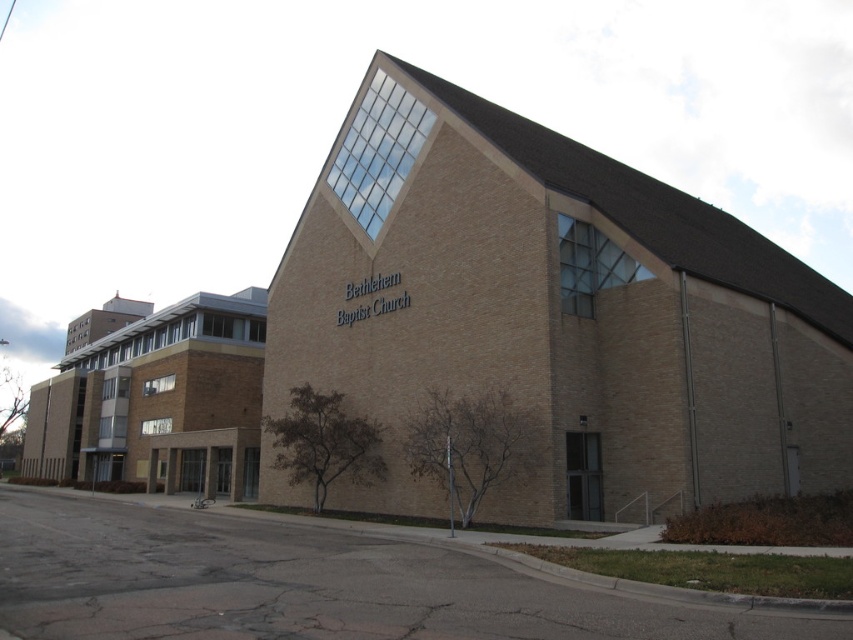
Question: Which object appears farthest from the camera in this image?

Choices:
 (A) brown brick building at left
 (B) brown brick church at center

Answer: (A)

Question: Is brown brick church at center to the left of brown brick building at left from the viewer's perspective?

Choices:
 (A) yes
 (B) no

Answer: (B)

Question: Which point is farther to the camera?

Choices:
 (A) brown brick church at center
 (B) brown brick building at left

Answer: (B)

Question: Which object appears closest to the camera in this image?

Choices:
 (A) brown brick building at left
 (B) brown brick church at center

Answer: (B)

Question: Can you confirm if brown brick church at center is bigger than brown brick building at left?

Choices:
 (A) yes
 (B) no

Answer: (B)

Question: Is brown brick church at center positioned at the back of brown brick building at left?

Choices:
 (A) yes
 (B) no

Answer: (B)